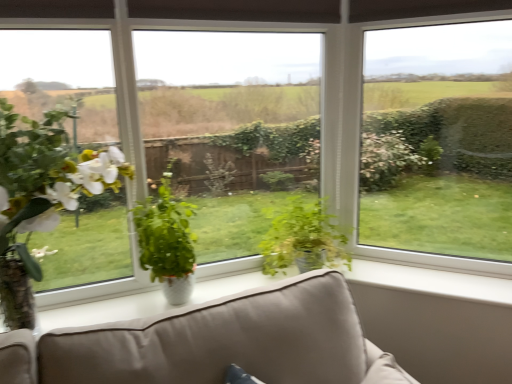
Question: Is the surface of green glossy plant at center, which is counted as the 2th houseplant, starting from the right, in direct contact with transparent glass window at center?

Choices:
 (A) yes
 (B) no

Answer: (B)

Question: Does green glossy plant at center, which is counted as the 2th houseplant, starting from the right, appear on the left side of transparent glass window at center?

Choices:
 (A) no
 (B) yes

Answer: (B)

Question: Considering the relative sizes of green glossy plant at center, the 2th houseplant viewed from the left, and transparent glass window at center in the image provided, is green glossy plant at center, the 2th houseplant viewed from the left, thinner than transparent glass window at center?

Choices:
 (A) yes
 (B) no

Answer: (B)

Question: From the image's perspective, is green glossy plant at center, which is counted as the 2th houseplant, starting from the right, on transparent glass window at center?

Choices:
 (A) yes
 (B) no

Answer: (B)

Question: Would you say transparent glass window at center is part of green glossy plant at center, which is counted as the 2th houseplant, starting from the right,'s contents?

Choices:
 (A) no
 (B) yes

Answer: (A)

Question: Looking at their shapes, would you say green glossy plant at center, the 3th houseplant when ordered from left to right, is wider or thinner than transparent glass window at center?

Choices:
 (A) thin
 (B) wide

Answer: (B)

Question: Is green glossy plant at center, the 3th houseplant when ordered from left to right, spatially inside transparent glass window at center, or outside of it?

Choices:
 (A) outside
 (B) inside

Answer: (A)

Question: Visually, is green glossy plant at center, the 3th houseplant when ordered from left to right, positioned to the left or to the right of transparent glass window at center?

Choices:
 (A) right
 (B) left

Answer: (B)

Question: From their relative heights in the image, would you say green glossy plant at center, the 3th houseplant when ordered from left to right, is taller or shorter than transparent glass window at center?

Choices:
 (A) tall
 (B) short

Answer: (B)

Question: In terms of width, does transparent glass window at center look wider or thinner when compared to green matte plant at left, which is counted as the 3th houseplant, starting from the right?

Choices:
 (A) wide
 (B) thin

Answer: (B)

Question: Is transparent glass window at center spatially inside green matte plant at left, which is counted as the 3th houseplant, starting from the right, or outside of it?

Choices:
 (A) outside
 (B) inside

Answer: (A)

Question: Is point (173, 132) positioned closer to the camera than point (61, 182)?

Choices:
 (A) closer
 (B) farther

Answer: (B)

Question: From a real-world perspective, is transparent glass window at center above or below green matte plant at left, which is the first houseplant from left to right?

Choices:
 (A) below
 (B) above

Answer: (B)

Question: Considering the relative positions of green glossy plant at center, the 2th houseplant viewed from the left, and green matte plant at left, which is counted as the 3th houseplant, starting from the right, in the image provided, is green glossy plant at center, the 2th houseplant viewed from the left, to the left or to the right of green matte plant at left, which is counted as the 3th houseplant, starting from the right,?

Choices:
 (A) right
 (B) left

Answer: (A)

Question: In terms of width, does green glossy plant at center, the 2th houseplant viewed from the left, look wider or thinner when compared to green matte plant at left, which is the first houseplant from left to right?

Choices:
 (A) thin
 (B) wide

Answer: (A)